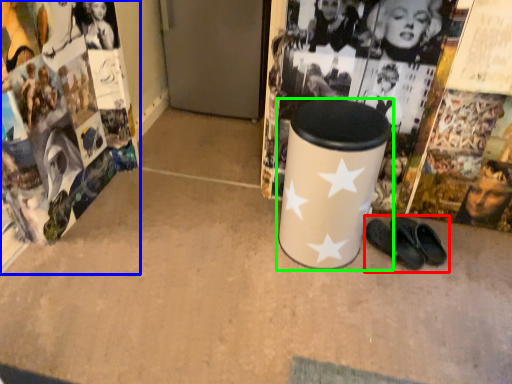
Question: Considering the real-world distances, which object is closest to footwear (highlighted by a red box)? magazine (highlighted by a blue box) or waste container (highlighted by a green box).

Choices:
 (A) magazine
 (B) waste container

Answer: (B)